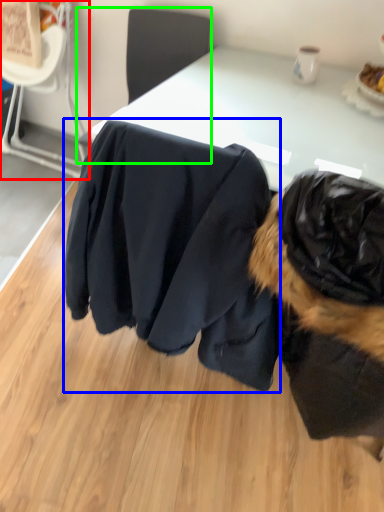
Question: Which object is positioned closest to chair (highlighted by a red box)? Select from clothing (highlighted by a blue box) and chair (highlighted by a green box).

Choices:
 (A) clothing
 (B) chair

Answer: (B)